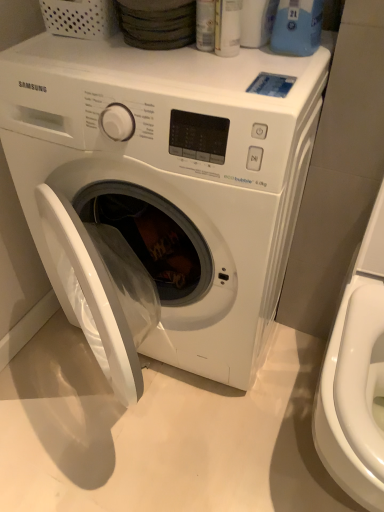
Question: In terms of width, does white glossy washer at right look wider or thinner when compared to blue plastic bottle at upper right?

Choices:
 (A) wide
 (B) thin

Answer: (A)

Question: Considering the positions of point (312, 433) and point (312, 29), is point (312, 433) closer or farther from the camera than point (312, 29)?

Choices:
 (A) farther
 (B) closer

Answer: (A)

Question: Estimate the real-world distances between objects in this image. Which object is closer to the white glossy washer at right?

Choices:
 (A) white glossy washing machine at center
 (B) blue plastic bottle at upper right

Answer: (A)

Question: Considering the real-world distances, which object is closest to the white glossy washer at right?

Choices:
 (A) white glossy washing machine at center
 (B) blue plastic bottle at upper right

Answer: (A)